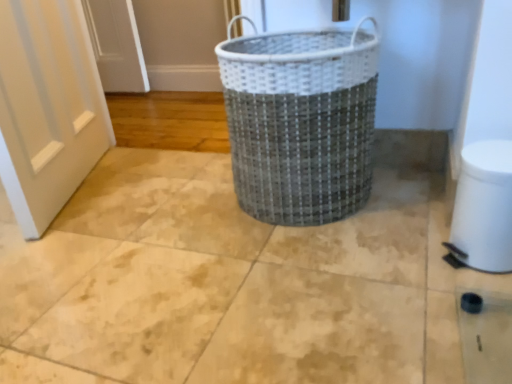
Identify the location of vacant space behind white plastic toilet bowl at lower right. This screenshot has width=512, height=384. (415, 223).